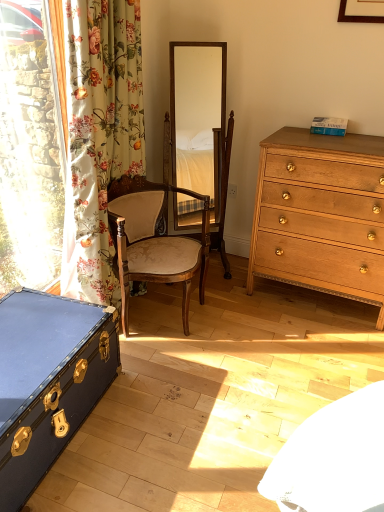
Question: Is point (69, 74) positioned closer to the camera than point (256, 212)?

Choices:
 (A) closer
 (B) farther

Answer: (A)

Question: From the image's perspective, relative to light brown wood chest of drawers at right, is floral fabric curtain at left above or below?

Choices:
 (A) below
 (B) above

Answer: (B)

Question: Based on their relative distances, which object is farther from the floral fabric curtain at left?

Choices:
 (A) wooden chair at center
 (B) blue leather trunk at lower left
 (C) white plastic power outlet at center
 (D) wooden mirror at center
 (E) light brown wood chest of drawers at right

Answer: (D)

Question: Which of these objects is positioned farthest from the floral fabric curtain at left?

Choices:
 (A) blue leather trunk at lower left
 (B) white plastic power outlet at center
 (C) wooden chair at center
 (D) wooden mirror at center
 (E) light brown wood chest of drawers at right

Answer: (D)